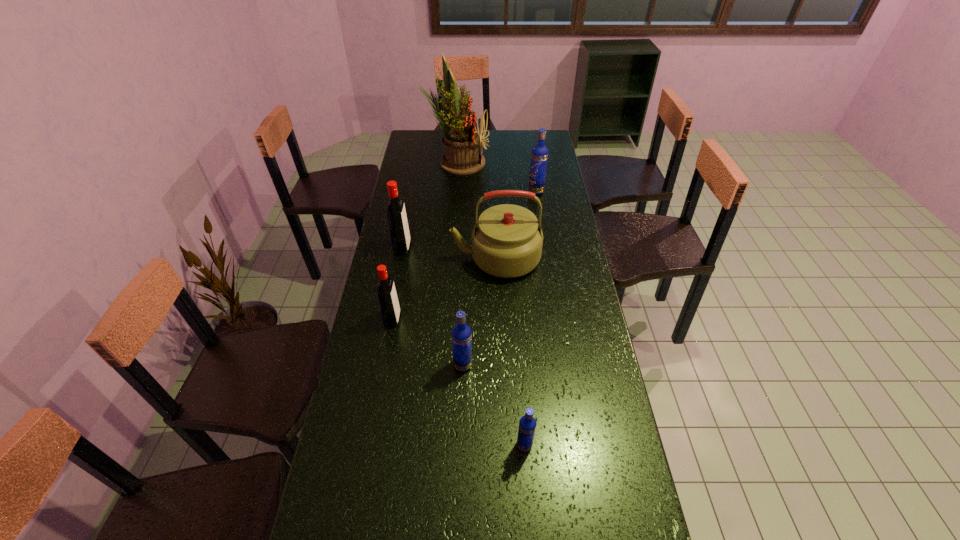
Locate an element on the screen. This screenshot has height=540, width=960. vacant area situated on the front and back of the fifth farthest object is located at coordinates (504, 319).

You are a GUI agent. You are given a task and a screenshot of the screen. Output one action in this format:
    pyautogui.click(x=<x>, y=<y>)
    Task: Click on the free location located on the back of the nearest object
    This screenshot has width=960, height=540.
    Given the screenshot: What is the action you would take?
    pyautogui.click(x=516, y=334)

Identify the location of object that is positioned at the far edge. The width and height of the screenshot is (960, 540). (461, 140).

The width and height of the screenshot is (960, 540). In order to click on flower arrangement that is at the left edge in this screenshot , I will do `click(461, 140)`.

Where is `kettle located at the right edge`? This screenshot has width=960, height=540. kettle located at the right edge is located at coordinates (507, 240).

Where is `vodka present at the right edge`? vodka present at the right edge is located at coordinates (539, 156).

Image resolution: width=960 pixels, height=540 pixels. What are the coordinates of `object present at the far left corner` in the screenshot? It's located at (461, 140).

Identify the location of free space at the far edge. The height and width of the screenshot is (540, 960). (499, 148).

Where is `free space at the left edge of the desktop`? The image size is (960, 540). free space at the left edge of the desktop is located at coordinates (415, 158).

You are a GUI agent. You are given a task and a screenshot of the screen. Output one action in this format:
    pyautogui.click(x=<x>, y=<y>)
    Task: Click on the vacant space at the right edge of the desktop
    
    Given the screenshot: What is the action you would take?
    pyautogui.click(x=549, y=166)